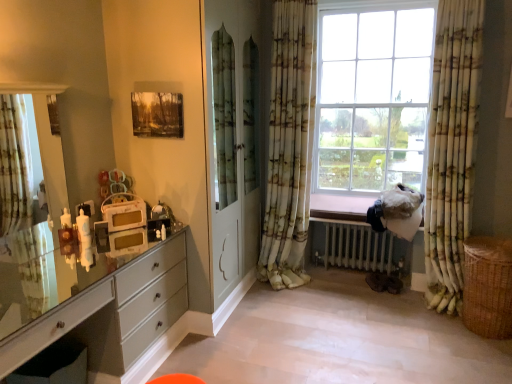
Where is `vacant space in front of braided wicker basket at lower right`? This screenshot has width=512, height=384. vacant space in front of braided wicker basket at lower right is located at coordinates (484, 361).